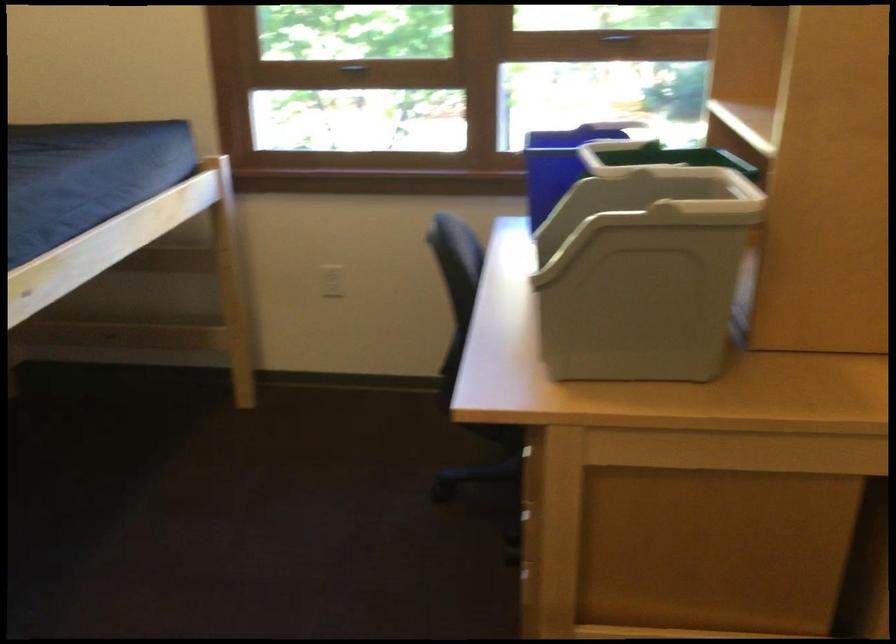
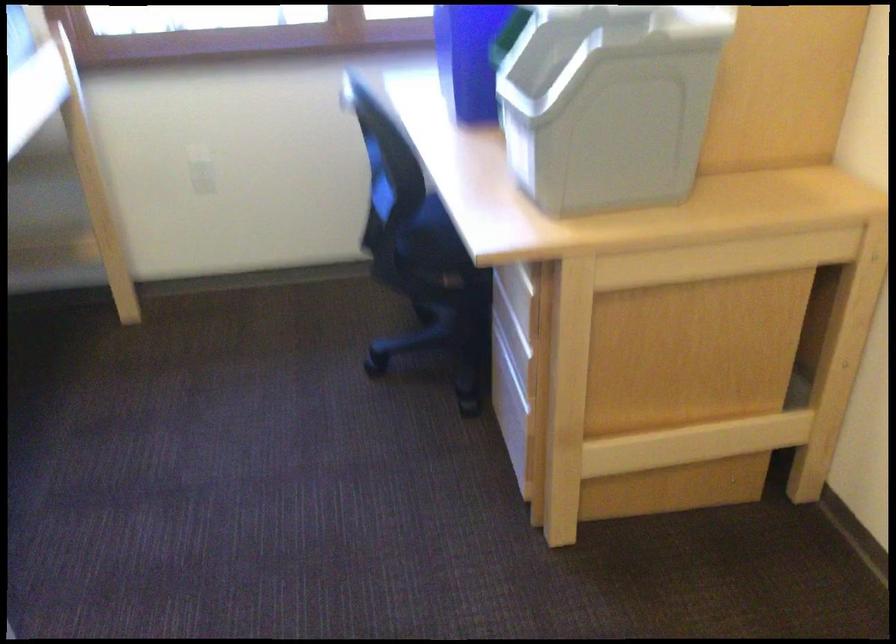
Question: The camera is either moving clockwise (left) or counter-clockwise (right) around the object. The first image is from the beginning of the video and the second image is from the end. Is the camera moving left or right when shooting the video?

Choices:
 (A) Left
 (B) Right

Answer: (A)